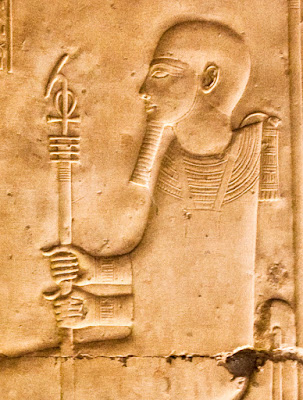
Identify the location of square pendant. This screenshot has width=303, height=400. (208, 223).